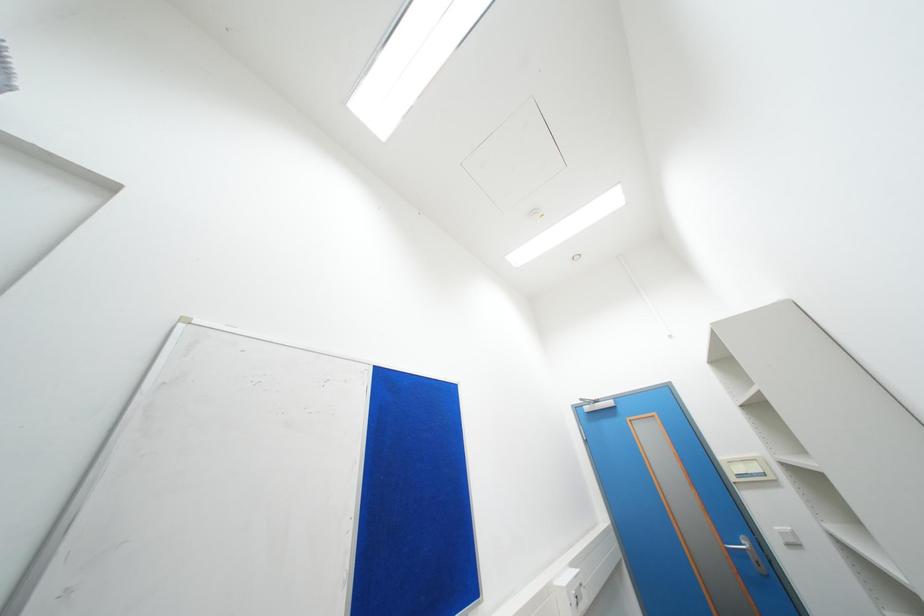
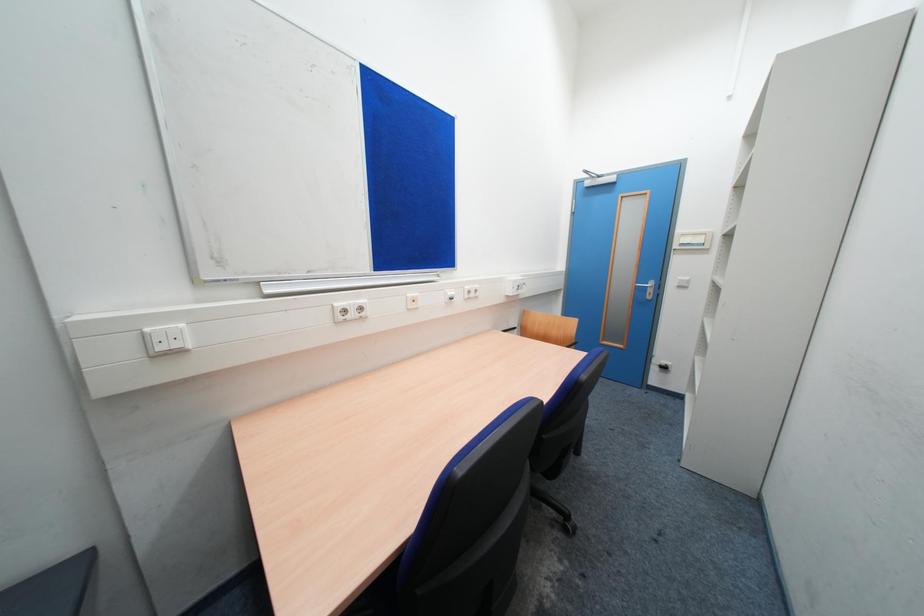
Question: The first image is from the beginning of the video and the second image is from the end. How did the camera likely rotate when shooting the video?

Choices:
 (A) Left
 (B) Right
 (C) Up
 (D) Down

Answer: (D)